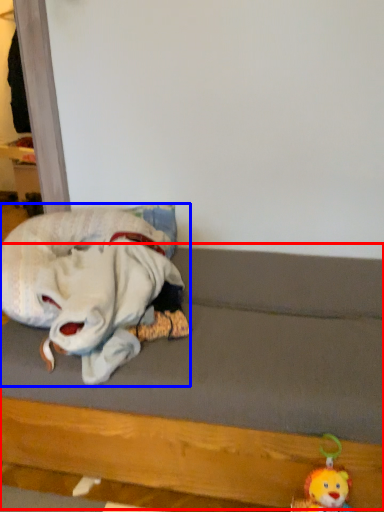
Question: Which of the following is the farthest to the observer, bed frame (highlighted by a red box) or toy (highlighted by a blue box)?

Choices:
 (A) bed frame
 (B) toy

Answer: (B)